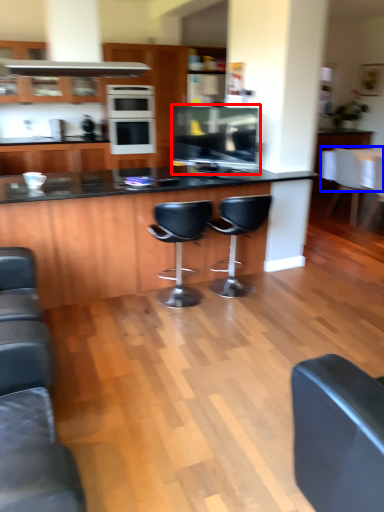
Question: Which object is closer to the camera taking this photo, appliance (highlighted by a red box) or counter top (highlighted by a blue box)?

Choices:
 (A) appliance
 (B) counter top

Answer: (A)